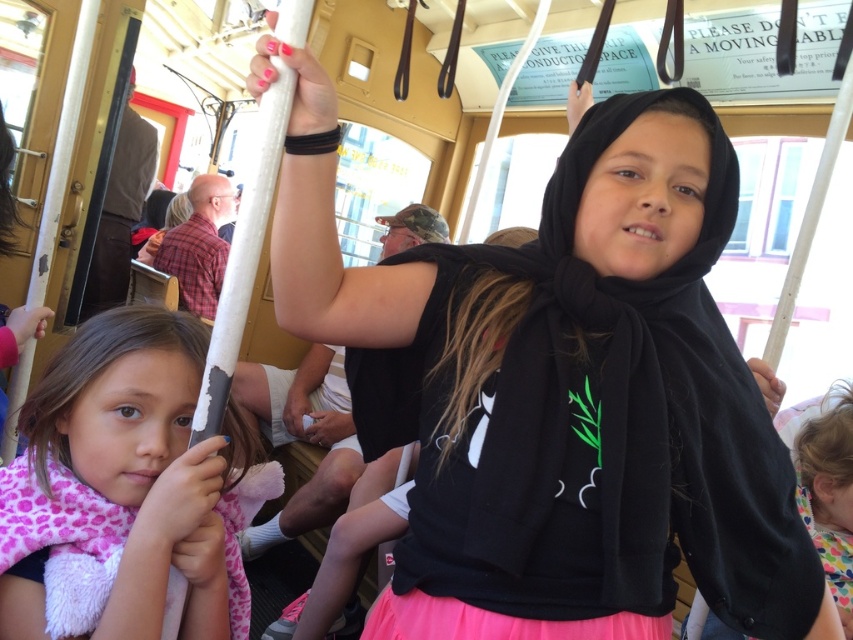
Does pink fabric at center have a greater width compared to pink fabric at lower right?

Indeed, pink fabric at center has a greater width compared to pink fabric at lower right.

Is pink fabric at center behind pink fabric at lower right?

No.

This screenshot has width=853, height=640. What do you see at coordinates (828, 493) in the screenshot?
I see `pink fabric at center` at bounding box center [828, 493].

I want to click on pink fabric at center, so click(x=828, y=493).

You are a GUI agent. You are given a task and a screenshot of the screen. Output one action in this format:
    pyautogui.click(x=<x>, y=<y>)
    Task: Click on the pink fabric at lower right
    The image size is (853, 640).
    Given the screenshot: What is the action you would take?
    pyautogui.click(x=828, y=496)

Looking at this image, can you confirm if pink fabric at lower right is thinner than brown leather coach at left?

Yes.

Who is more forward, (827, 410) or (119, 160)?

Point (827, 410) is more forward.

Locate an element on the screen. The image size is (853, 640). pink fabric at lower right is located at coordinates pyautogui.click(x=828, y=496).

Does pink fleece scarf at left have a lesser height compared to pink fabric at center?

Indeed, pink fleece scarf at left has a lesser height compared to pink fabric at center.

Who is shorter, pink fleece scarf at left or pink fabric at center?

pink fleece scarf at left is shorter.

Which is in front, point (114, 502) or point (724, 627)?

Point (114, 502) is in front.

This screenshot has height=640, width=853. In order to click on pink fleece scarf at left in this screenshot , I will do `click(132, 484)`.